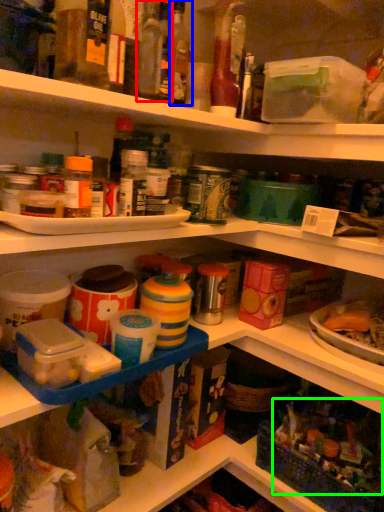
Question: Which object is positioned farthest from bottle (highlighted by a red box)? Select from bottle (highlighted by a blue box) and food (highlighted by a green box).

Choices:
 (A) bottle
 (B) food

Answer: (B)